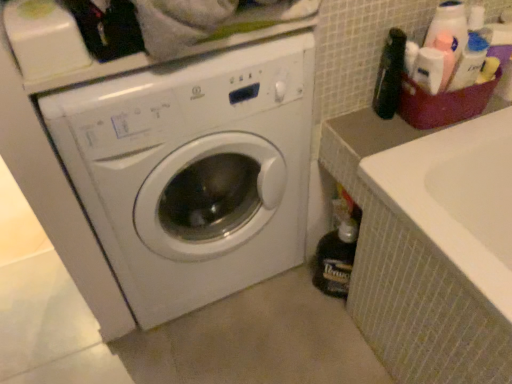
Question: From a real-world perspective, is plastic basket at upper right below dark brown glass bottle at lower right, the second bottle in the front-to-back sequence?

Choices:
 (A) yes
 (B) no

Answer: (B)

Question: Considering the relative sizes of plastic basket at upper right and dark brown glass bottle at lower right, the second bottle in the front-to-back sequence, in the image provided, is plastic basket at upper right taller than dark brown glass bottle at lower right, the second bottle in the front-to-back sequence,?

Choices:
 (A) yes
 (B) no

Answer: (B)

Question: Could dark brown glass bottle at lower right, which is the 1th bottle from back to front, be considered to be inside plastic basket at upper right?

Choices:
 (A) no
 (B) yes

Answer: (A)

Question: Could you tell me if plastic basket at upper right is facing dark brown glass bottle at lower right, which is the 1th bottle from back to front?

Choices:
 (A) no
 (B) yes

Answer: (A)

Question: From the image's perspective, is plastic basket at upper right located above dark brown glass bottle at lower right, which is the 1th bottle from back to front?

Choices:
 (A) no
 (B) yes

Answer: (B)

Question: Can you confirm if plastic basket at upper right is thinner than dark brown glass bottle at lower right, which is the 1th bottle from back to front?

Choices:
 (A) no
 (B) yes

Answer: (A)

Question: From the image's perspective, does white glossy washing machine at center appear lower than dark brown glass bottle at lower right, which appears as the 2th bottle when viewed from the top?

Choices:
 (A) yes
 (B) no

Answer: (B)

Question: Are white glossy washing machine at center and dark brown glass bottle at lower right, the second bottle in the front-to-back sequence, far apart?

Choices:
 (A) yes
 (B) no

Answer: (B)

Question: Is white glossy washing machine at center positioned beyond the bounds of dark brown glass bottle at lower right, which is the 1th bottle from back to front?

Choices:
 (A) yes
 (B) no

Answer: (A)

Question: Does white glossy washing machine at center have a larger size compared to dark brown glass bottle at lower right, which appears as the 2th bottle when viewed from the top?

Choices:
 (A) no
 (B) yes

Answer: (B)

Question: Is white glossy washing machine at center to the left of dark brown glass bottle at lower right, the first bottle ordered from the bottom, from the viewer's perspective?

Choices:
 (A) yes
 (B) no

Answer: (A)

Question: Is white glossy washing machine at center turned away from dark brown glass bottle at lower right, the second bottle in the front-to-back sequence?

Choices:
 (A) yes
 (B) no

Answer: (B)

Question: Does dark brown glass bottle at lower right, which is the 1th bottle from back to front, have a greater height compared to white glossy washing machine at center?

Choices:
 (A) yes
 (B) no

Answer: (B)